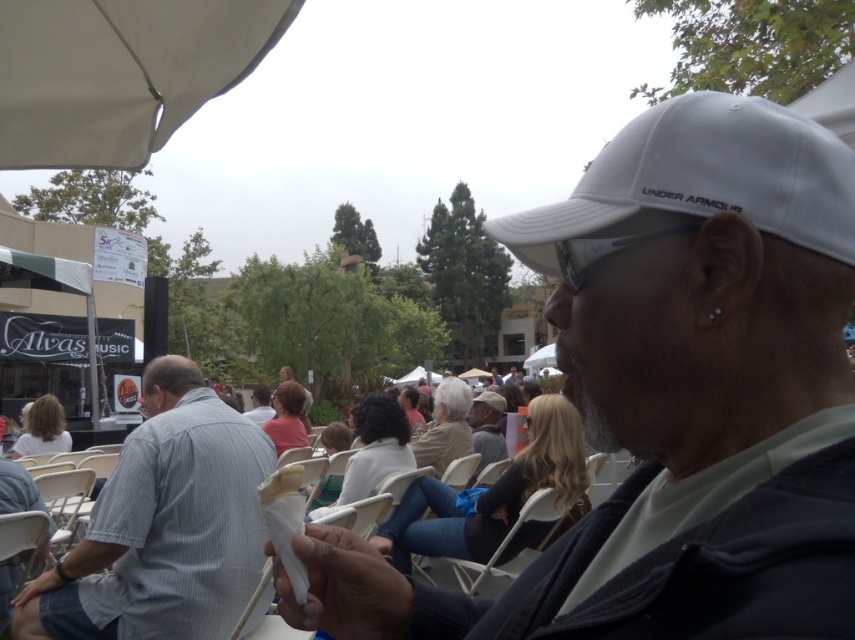
Who is shorter, white plastic chairs at center or white fabric canopy at upper left?

white fabric canopy at upper left is shorter.

Which is more to the left, white plastic chairs at center or white fabric canopy at upper left?

From the viewer's perspective, white plastic chairs at center appears more on the left side.

This screenshot has width=855, height=640. Find the location of `white plastic chairs at center`. white plastic chairs at center is located at coordinates (162, 525).

Does striped cotton shirt at center have a smaller size compared to white fabric canopy at upper left?

Answer: No.

From the picture: Can you confirm if striped cotton shirt at center is positioned above white fabric canopy at upper left?

No, striped cotton shirt at center is not above white fabric canopy at upper left.

Describe the element at coordinates (163, 525) in the screenshot. I see `striped cotton shirt at center` at that location.

Locate an element on the screen. This screenshot has width=855, height=640. striped cotton shirt at center is located at coordinates coord(163,525).

Does striped cotton shirt at center appear on the left side of white plastic chairs at center?

No, striped cotton shirt at center is not to the left of white plastic chairs at center.

Is point (213, 492) less distant than point (228, 560)?

No, (213, 492) is further to viewer.

Who is more forward, (225, 568) or (199, 488)?

Point (225, 568) is more forward.

Where is `striped cotton shirt at center`? The width and height of the screenshot is (855, 640). striped cotton shirt at center is located at coordinates (163, 525).